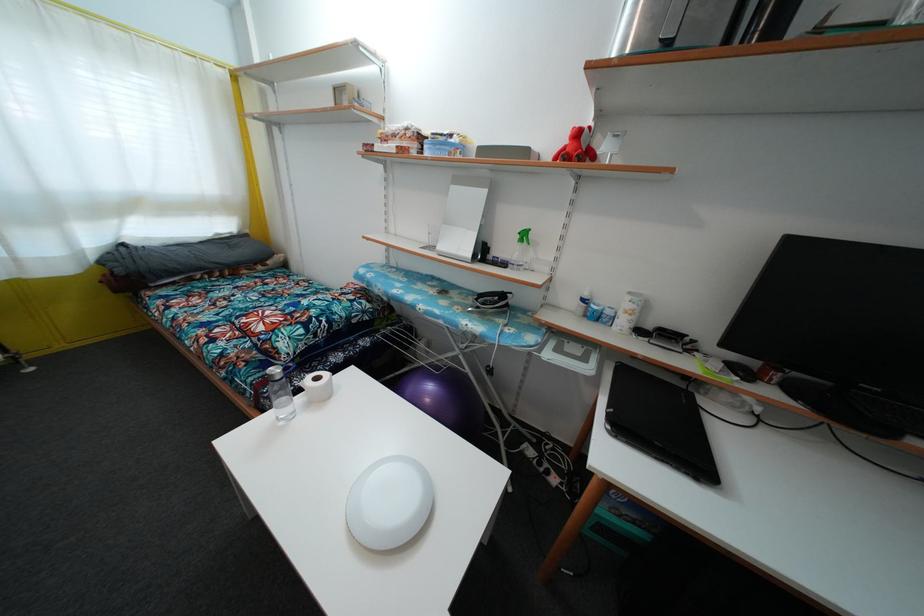
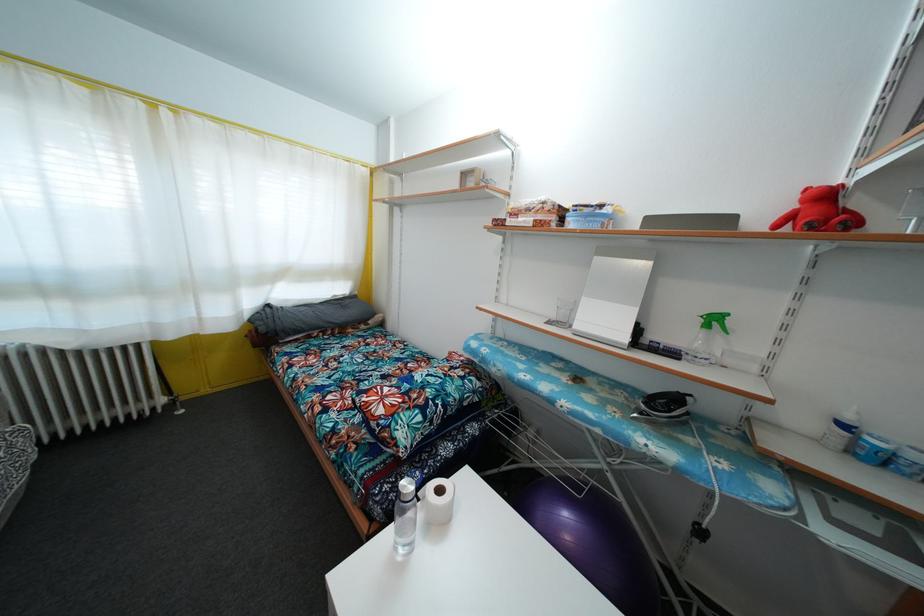
The point at (x=280, y=377) is marked in the first image. Where is the corresponding point in the second image?

(410, 492)